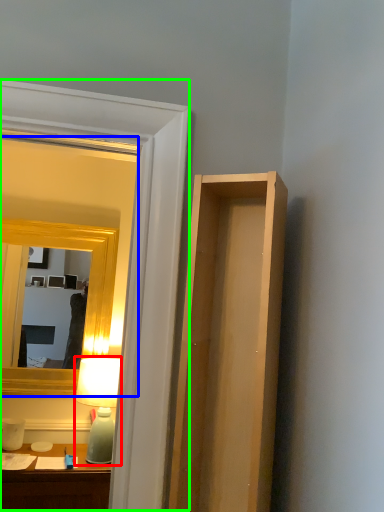
Question: Which object is the closest to the table lamp (highlighted by a red box)? Choose among these: mirror (highlighted by a blue box) or glass door (highlighted by a green box).

Choices:
 (A) mirror
 (B) glass door

Answer: (A)